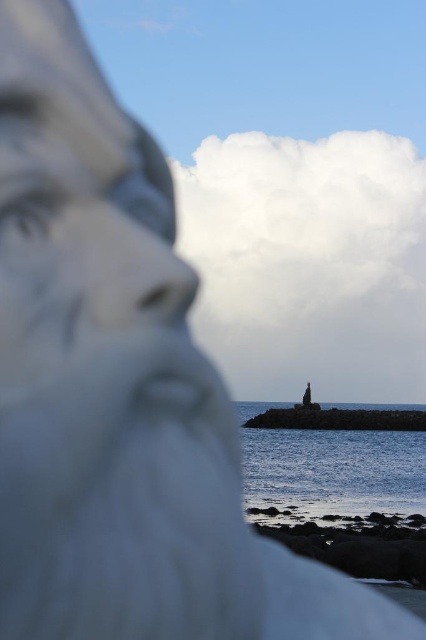
Question: Is blue water at lower center below smooth concrete pier at center?

Choices:
 (A) yes
 (B) no

Answer: (A)

Question: Which point is closer to the camera?

Choices:
 (A) (270, 451)
 (B) (402, 413)
 (C) (302, 401)

Answer: (A)

Question: Among these points, which one is farthest from the camera?

Choices:
 (A) (305, 388)
 (B) (302, 515)

Answer: (A)

Question: Is blue water at lower center below smooth concrete pier at center?

Choices:
 (A) no
 (B) yes

Answer: (B)

Question: Can you confirm if blue water at lower center is positioned to the right of smooth stone statue at center?

Choices:
 (A) no
 (B) yes

Answer: (B)

Question: Among these points, which one is farthest from the camera?

Choices:
 (A) (385, 420)
 (B) (388, 512)
 (C) (307, 392)

Answer: (C)